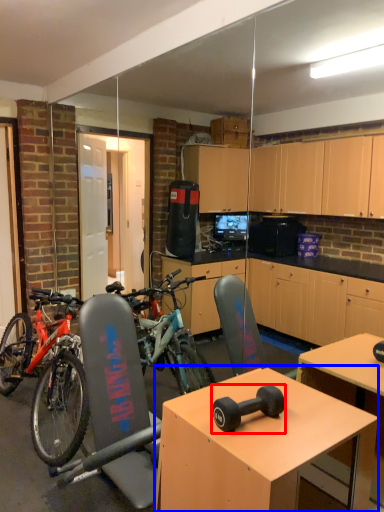
Question: Which object appears closest to the camera in this image, dumbbell (highlighted by a red box) or desk (highlighted by a blue box)?

Choices:
 (A) dumbbell
 (B) desk

Answer: (B)